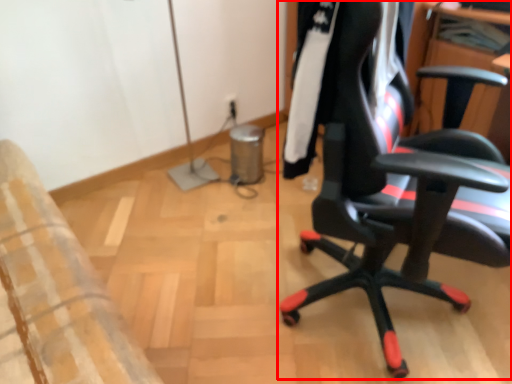
Question: From the image's perspective, what is the correct spatial relationship of chair (annotated by the red box) in relation to clothing?

Choices:
 (A) below
 (B) above

Answer: (A)